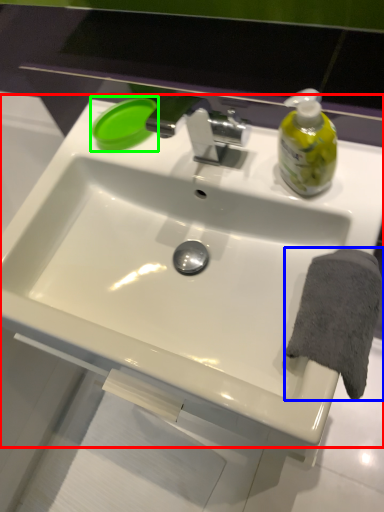
Question: Estimate the real-world distances between objects in this image. Which object is closer to sink (highlighted by a red box), bath towel (highlighted by a blue box) or soap (highlighted by a green box)?

Choices:
 (A) bath towel
 (B) soap

Answer: (A)